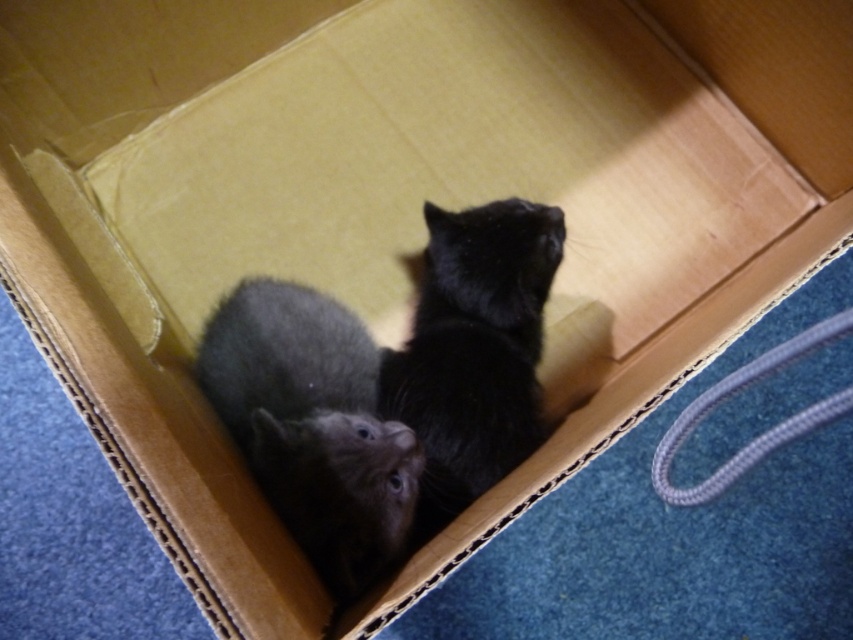
Who is positioned more to the left, fuzzy gray cat at center or black fluffy cat at center?

fuzzy gray cat at center

From the picture: Who is positioned more to the right, fuzzy gray cat at center or black fluffy cat at center?

From the viewer's perspective, black fluffy cat at center appears more on the right side.

Between point (247, 332) and point (488, 211), which one is positioned behind?

The point (488, 211) is behind.

This screenshot has width=853, height=640. In order to click on fuzzy gray cat at center in this screenshot , I will do `click(312, 426)`.